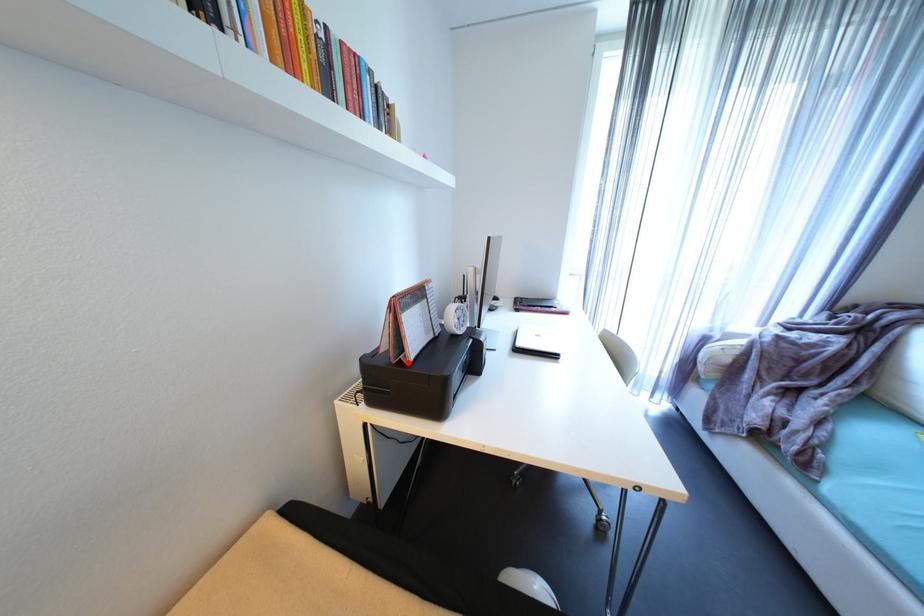
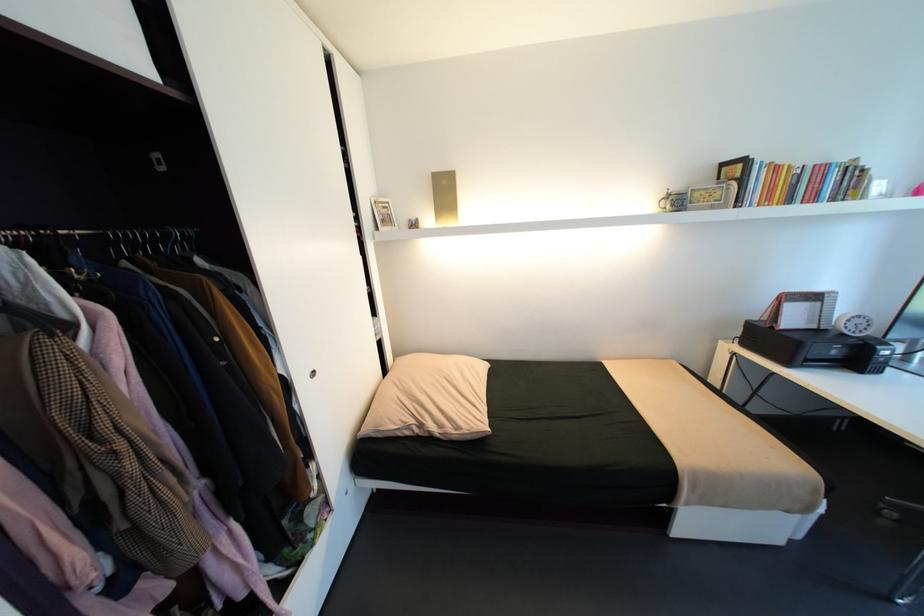
Find the pixel in the second image that matches the highlighted location in the first image.

(779, 328)